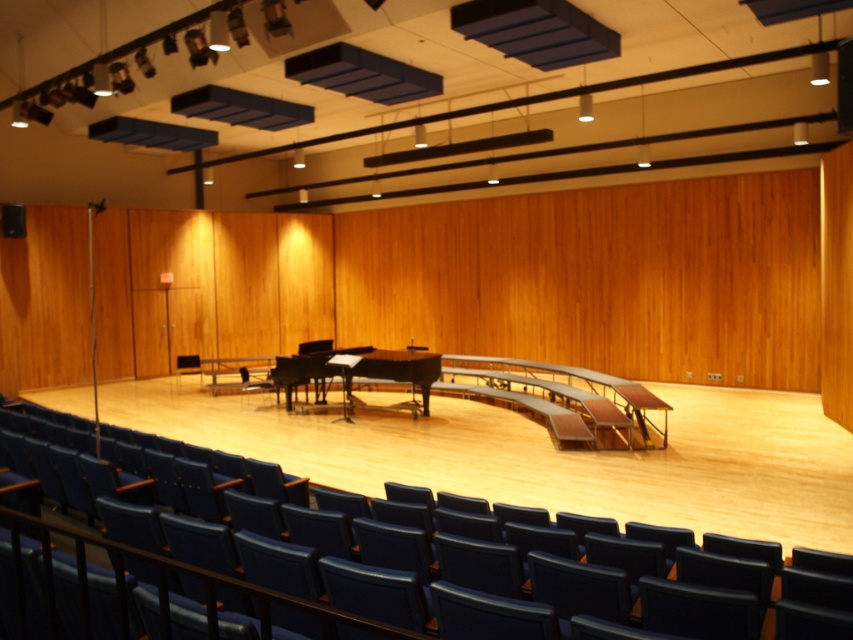
Question: Considering the real-world distances, which object is farthest from the dark blue fabric chair at center?

Choices:
 (A) shiny black piano at center
 (B) blue leather chair at center

Answer: (B)

Question: Can you confirm if blue leather chair at center is wider than shiny black piano at center?

Choices:
 (A) no
 (B) yes

Answer: (B)

Question: Estimate the real-world distances between objects in this image. Which object is farther from the blue leather chair at center?

Choices:
 (A) shiny black piano at center
 (B) dark blue fabric chair at center

Answer: (B)

Question: Which point is farther to the camera?

Choices:
 (A) coord(409,358)
 (B) coord(483,458)
 (C) coord(184,362)

Answer: (C)

Question: Does blue leather chair at center come in front of shiny black piano at center?

Choices:
 (A) yes
 (B) no

Answer: (A)

Question: Can you confirm if shiny black piano at center is smaller than dark blue fabric chair at center?

Choices:
 (A) no
 (B) yes

Answer: (A)